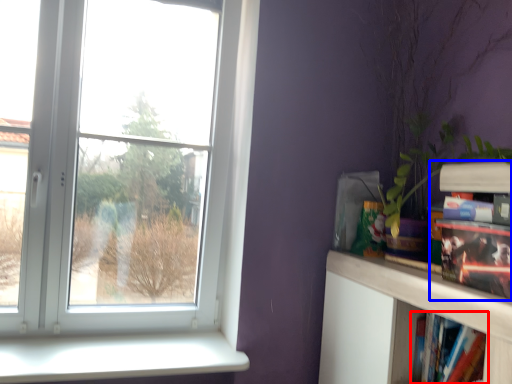
Question: Which of the following is the farthest to the observer, book (highlighted by a red box) or book (highlighted by a blue box)?

Choices:
 (A) book
 (B) book

Answer: (A)